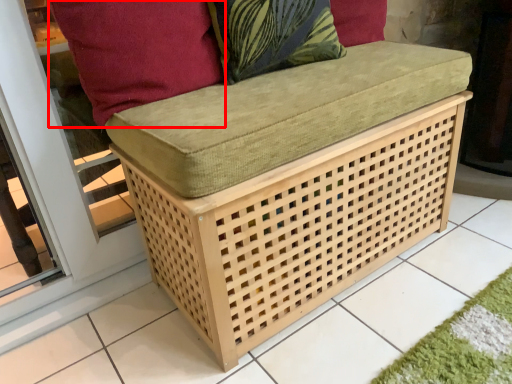
Question: Where is pillow (annotated by the red box) located in relation to throw pillow in the image?

Choices:
 (A) right
 (B) left

Answer: (B)